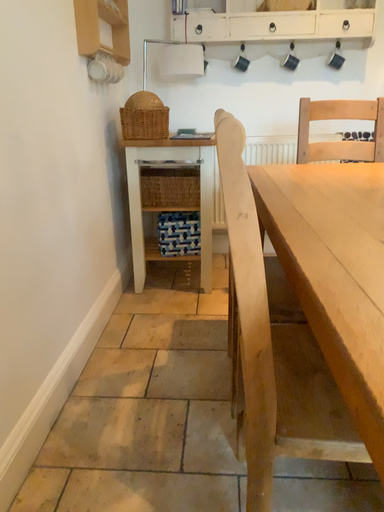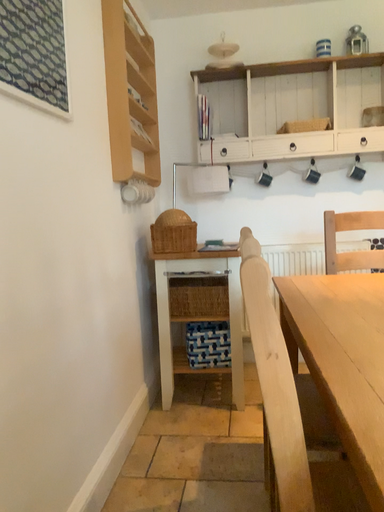
Question: How did the camera likely rotate when shooting the video?

Choices:
 (A) rotated downward
 (B) rotated upward

Answer: (B)